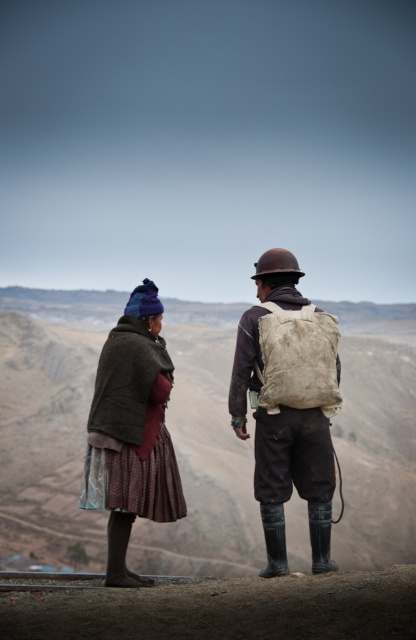
Is brown woolen coat at center wider than dark brown woolen coat at left?

Yes, brown woolen coat at center is wider than dark brown woolen coat at left.

Is brown woolen coat at center to the right of dark brown woolen coat at left from the viewer's perspective?

Correct, you'll find brown woolen coat at center to the right of dark brown woolen coat at left.

Is point (257, 465) closer to viewer compared to point (158, 401)?

Yes, point (257, 465) is closer to viewer.

The height and width of the screenshot is (640, 416). In order to click on brown woolen coat at center in this screenshot , I will do `click(289, 404)`.

Is point (321, 512) closer to viewer compared to point (103, 461)?

Yes, it is in front of point (103, 461).

Who is shorter, matte brown backpack at center or dark brown woolen coat at left?

dark brown woolen coat at left

Where is `matte brown backpack at center`? This screenshot has height=640, width=416. matte brown backpack at center is located at coordinates (287, 404).

Where is `matte brown backpack at center`? matte brown backpack at center is located at coordinates (287, 404).

Consider the image. Does brown woolen coat at center have a greater width compared to matte brown backpack at center?

Incorrect, brown woolen coat at center's width does not surpass matte brown backpack at center's.

Does brown woolen coat at center appear over matte brown backpack at center?

Yes.

Find the location of a particular element. brown woolen coat at center is located at coordinates (289, 404).

Locate an element on the screen. brown woolen coat at center is located at coordinates (289, 404).